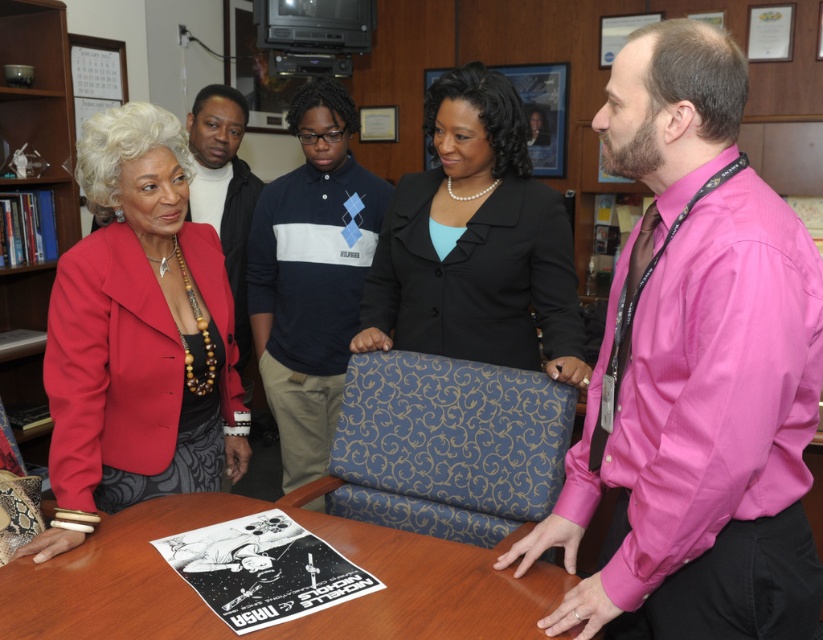
Is pink satin shirt at right to the right of navy blue sweater at center from the viewer's perspective?

Correct, you'll find pink satin shirt at right to the right of navy blue sweater at center.

Does pink satin shirt at right lie behind navy blue sweater at center?

No, pink satin shirt at right is in front of navy blue sweater at center.

Measure the distance between point (700,348) and camera.

The distance of point (700,348) from camera is 98.86 centimeters.

Where is `pink satin shirt at right`? pink satin shirt at right is located at coordinates (694, 372).

Consider the image. Is black satin blazer at center further to camera compared to wooden table at center?

Yes, it is.

At what (x,y) coordinates should I click in order to perform the action: click on black satin blazer at center. Please return your answer as a coordinate pair (x, y). This screenshot has height=640, width=823. Looking at the image, I should click on (475, 243).

Which is more to the right, navy blue sweater at center or wooden bookshelf at upper left?

navy blue sweater at center

Is point (303, 179) in front of point (54, 214)?

Yes, it is in front of point (54, 214).

The height and width of the screenshot is (640, 823). I want to click on navy blue sweater at center, so click(310, 275).